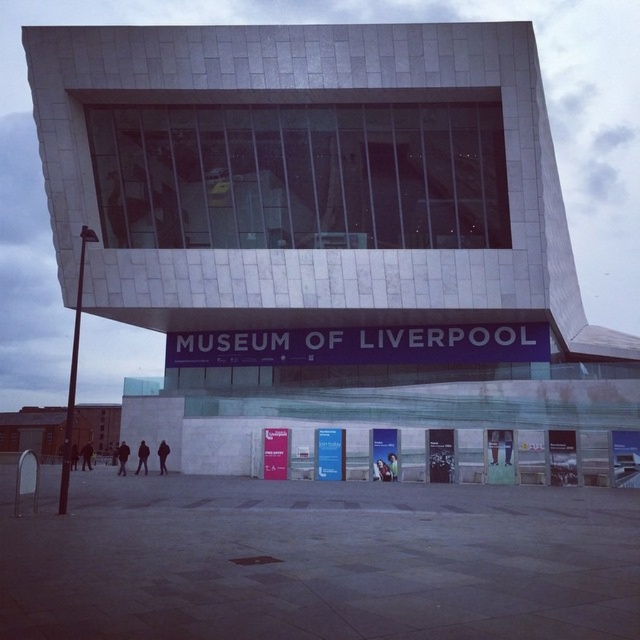
Question: Which object appears closest to the camera in this image?

Choices:
 (A) dark blue jacket at center
 (B) light brown leather jacket at center

Answer: (B)

Question: Is black fabric person at lower left below dark blue jacket at center?

Choices:
 (A) yes
 (B) no

Answer: (B)

Question: Can you confirm if black leather jacket at lower left is positioned above light brown leather jacket at center?

Choices:
 (A) yes
 (B) no

Answer: (B)

Question: Which object is farther from the camera taking this photo?

Choices:
 (A) black leather jacket at lower left
 (B) black fabric person at lower left
 (C) black fabric jacket at lower left
 (D) dark blue jacket at center

Answer: (A)

Question: Considering the relative positions of black leather jacket at lower center and blue fabric person at center in the image provided, where is black leather jacket at lower center located with respect to blue fabric person at center?

Choices:
 (A) right
 (B) left

Answer: (B)

Question: Considering the real-world distances, which object is farthest from the green fabric jacket at center?

Choices:
 (A) dark brown leather jacket at lower center
 (B) black fabric person at lower left

Answer: (B)